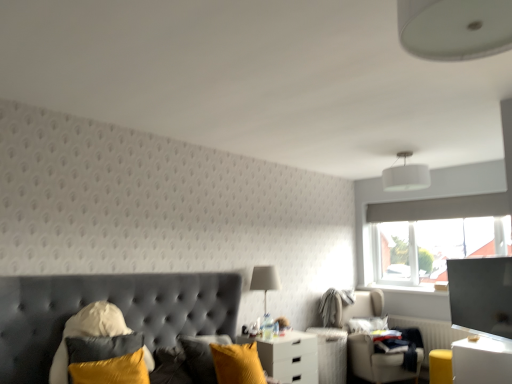
Question: Which direction should I rotate to face white glossy nightstand at center, positioned as the 1th nightstand in left-to-right order, — up or down?

Choices:
 (A) up
 (B) down

Answer: (B)

Question: Considering the relative sizes of white glossy nightstand at lower right, which is the second nightstand in back-to-front order, and white fabric lampshade at upper center in the image provided, is white glossy nightstand at lower right, which is the second nightstand in back-to-front order, shorter than white fabric lampshade at upper center?

Choices:
 (A) yes
 (B) no

Answer: (B)

Question: Are white glossy nightstand at lower right, which is the second nightstand in back-to-front order, and white fabric lampshade at upper center located far from each other?

Choices:
 (A) yes
 (B) no

Answer: (A)

Question: Would you say white glossy nightstand at lower right, which is the second nightstand in back-to-front order, contains white fabric lampshade at upper center?

Choices:
 (A) no
 (B) yes

Answer: (A)

Question: Is white fabric lampshade at upper center at the back of white glossy nightstand at lower right, the second nightstand from the left?

Choices:
 (A) yes
 (B) no

Answer: (B)

Question: From a real-world perspective, is white glossy nightstand at lower right, which is counted as the 1th nightstand, starting from the front, located beneath white fabric lampshade at upper center?

Choices:
 (A) no
 (B) yes

Answer: (B)

Question: Does white glossy nightstand at lower right, the second nightstand from the left, have a greater height compared to white fabric lampshade at upper center?

Choices:
 (A) yes
 (B) no

Answer: (A)

Question: Does soft white pillow at lower right, which appears as the 1th pillow when viewed from the right, appear on the right side of white glossy nightstand at center, positioned as the 1th nightstand in left-to-right order?

Choices:
 (A) yes
 (B) no

Answer: (A)

Question: From the image's perspective, would you say soft white pillow at lower right, acting as the second pillow starting from the front, is shown under white glossy nightstand at center, the second nightstand viewed from the front?

Choices:
 (A) yes
 (B) no

Answer: (B)

Question: From a real-world perspective, is soft white pillow at lower right, positioned as the 1th pillow in back-to-front order, physically above white glossy nightstand at center, which is the first nightstand in back-to-front order?

Choices:
 (A) no
 (B) yes

Answer: (B)

Question: Is white glossy nightstand at center, which is the first nightstand in back-to-front order, located within soft white pillow at lower right, the first pillow from the bottom?

Choices:
 (A) yes
 (B) no

Answer: (B)

Question: Is soft white pillow at lower right, the 2th pillow viewed from the left, in contact with white glossy nightstand at center, which is the first nightstand in back-to-front order?

Choices:
 (A) no
 (B) yes

Answer: (A)

Question: Considering the relative positions of soft white pillow at lower right, the 2th pillow viewed from the left, and white glossy nightstand at center, the second nightstand viewed from the front, in the image provided, is soft white pillow at lower right, the 2th pillow viewed from the left, in front of white glossy nightstand at center, the second nightstand viewed from the front,?

Choices:
 (A) yes
 (B) no

Answer: (B)

Question: Is velvet yellow pillow at lower left, which is the 1th pillow from front to back, further to camera compared to white glossy nightstand at lower right, the 1th nightstand positioned from the right?

Choices:
 (A) no
 (B) yes

Answer: (A)